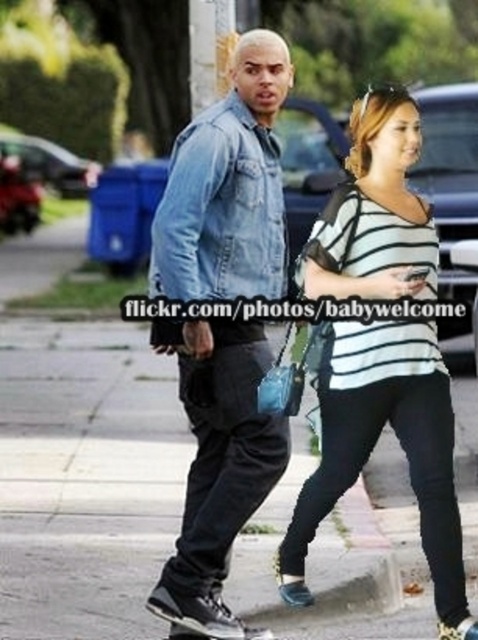
Question: Does gray concrete sidewalk at center appear under striped jersey at center?

Choices:
 (A) no
 (B) yes

Answer: (B)

Question: Does gray concrete sidewalk at center appear under striped jersey at center?

Choices:
 (A) no
 (B) yes

Answer: (B)

Question: Among these objects, which one is farthest from the camera?

Choices:
 (A) denim jacket at center
 (B) gray concrete sidewalk at center
 (C) striped jersey at center

Answer: (B)

Question: Is gray concrete sidewalk at center positioned behind striped jersey at center?

Choices:
 (A) no
 (B) yes

Answer: (B)

Question: Based on their relative distances, which object is farther from the striped jersey at center?

Choices:
 (A) denim jacket at center
 (B) gray concrete sidewalk at center

Answer: (B)

Question: Based on their relative distances, which object is farther from the gray concrete sidewalk at center?

Choices:
 (A) striped jersey at center
 (B) denim jacket at center

Answer: (B)